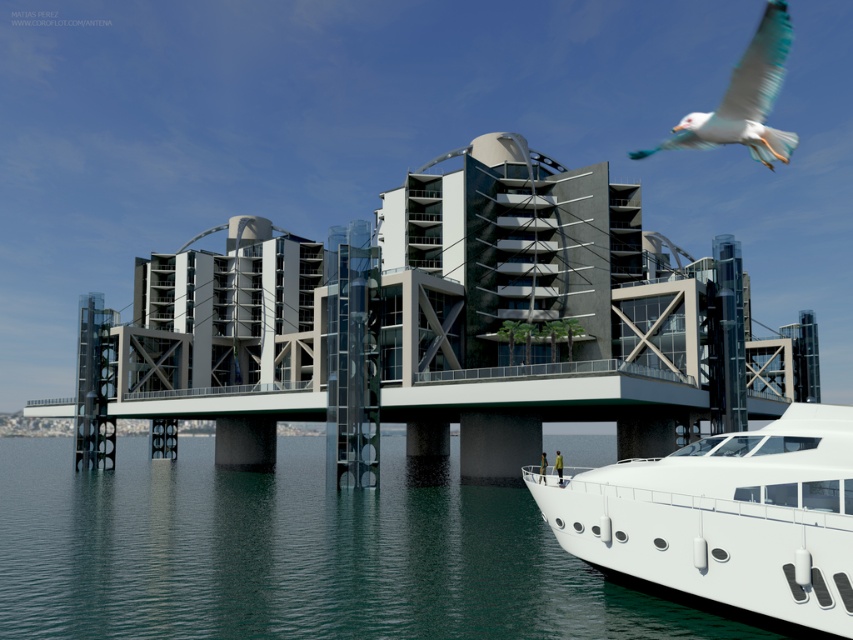
Who is taller, white glossy yacht at lower right or white feathered bird at upper right?

white feathered bird at upper right

Is white glossy yacht at lower right in front of white feathered bird at upper right?

Yes, it is.

Identify the location of white glossy yacht at lower right. Image resolution: width=853 pixels, height=640 pixels. (724, 516).

Can you confirm if greenish-blue water at lower left is bigger than white glossy yacht at lower right?

Indeed, greenish-blue water at lower left has a larger size compared to white glossy yacht at lower right.

What do you see at coordinates (294, 554) in the screenshot?
I see `greenish-blue water at lower left` at bounding box center [294, 554].

I want to click on greenish-blue water at lower left, so click(x=294, y=554).

Looking at this image, between greenish-blue water at lower left and white feathered bird at upper right, which one has more height?

white feathered bird at upper right is taller.

Where is `greenish-blue water at lower left`? The image size is (853, 640). greenish-blue water at lower left is located at coordinates (294, 554).

What are the coordinates of `greenish-blue water at lower left` in the screenshot? It's located at (294, 554).

You are a GUI agent. You are given a task and a screenshot of the screen. Output one action in this format:
    pyautogui.click(x=<x>, y=<y>)
    Task: Click on the greenish-blue water at lower left
    Image resolution: width=853 pixels, height=640 pixels.
    Given the screenshot: What is the action you would take?
    pyautogui.click(x=294, y=554)